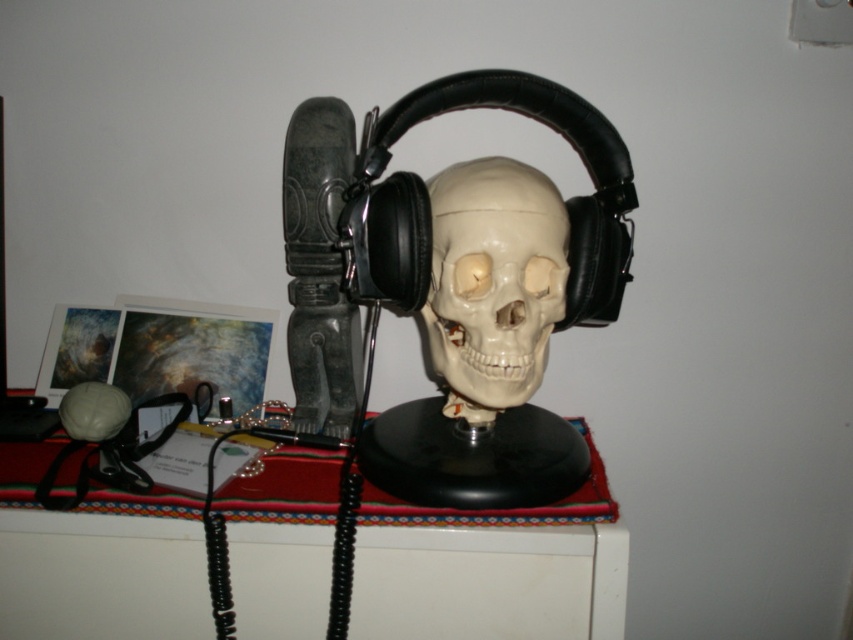
You are a delivery person who needs to place a package that is 23 centimeters long on the white glossy table at center. However, there is a white matte skull at center in the way. Can the package be placed entirely on the table without overlapping the skull?

The white glossy table at center and white matte skull at center are 22.98 centimeters apart from each other. Since the package is 23 centimeters long, it can be placed on the table without overlapping the skull as there is sufficient space between them.

You are an interior designer arranging a modern art exhibit. You have a white glossy table at center and a white matte skull at center in your collection. According to the scene, which object is closer to the viewer?

The white glossy table at center is closer to the viewer because it is positioned in front of the white matte skull at center.